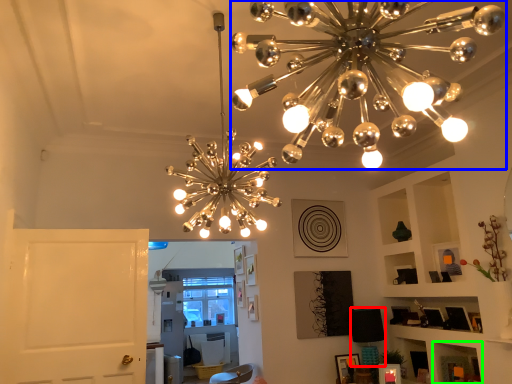
Question: Considering the real-world distances, which object is closest to lamp (highlighted by a red box)? lamp (highlighted by a blue box) or shelf (highlighted by a green box).

Choices:
 (A) lamp
 (B) shelf

Answer: (B)